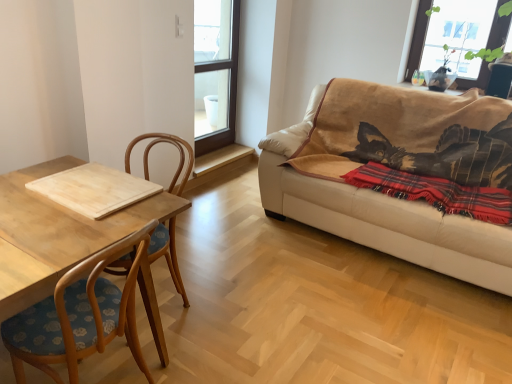
You are a GUI agent. You are given a task and a screenshot of the screen. Output one action in this format:
    pyautogui.click(x=<x>, y=<y>)
    Task: Click on the unoccupied region to the right of light wood cutting board at left
    
    Given the screenshot: What is the action you would take?
    pyautogui.click(x=241, y=327)